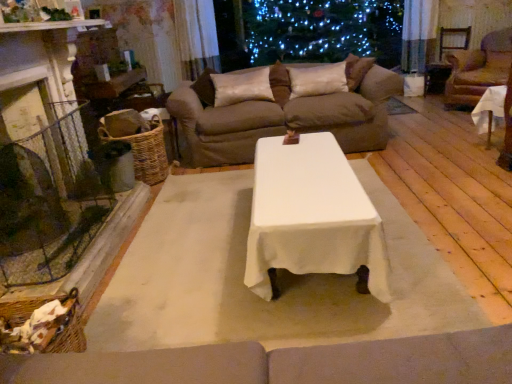
At what (x,y) coordinates should I click in order to perform the action: click on empty space that is to the right of woven brown basket at left. Please return your answer as a coordinate pair (x, y). Looking at the image, I should click on (193, 178).